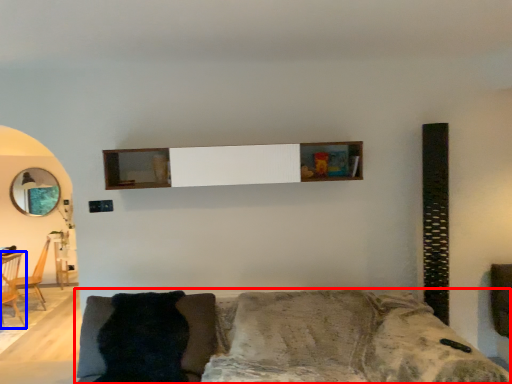
Question: Which of the following is the farthest to the observer, studio couch (highlighted by a red box) or armchair (highlighted by a blue box)?

Choices:
 (A) studio couch
 (B) armchair

Answer: (B)